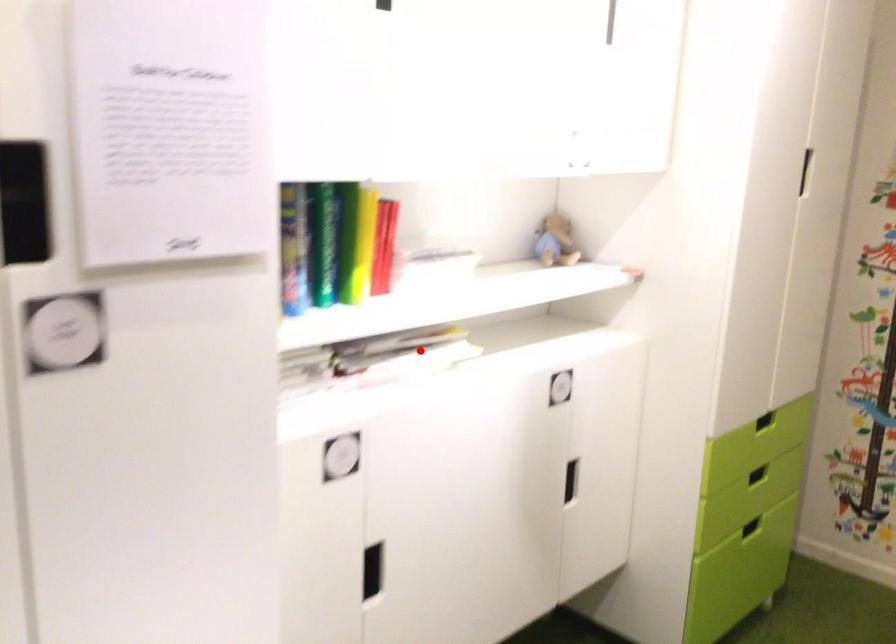
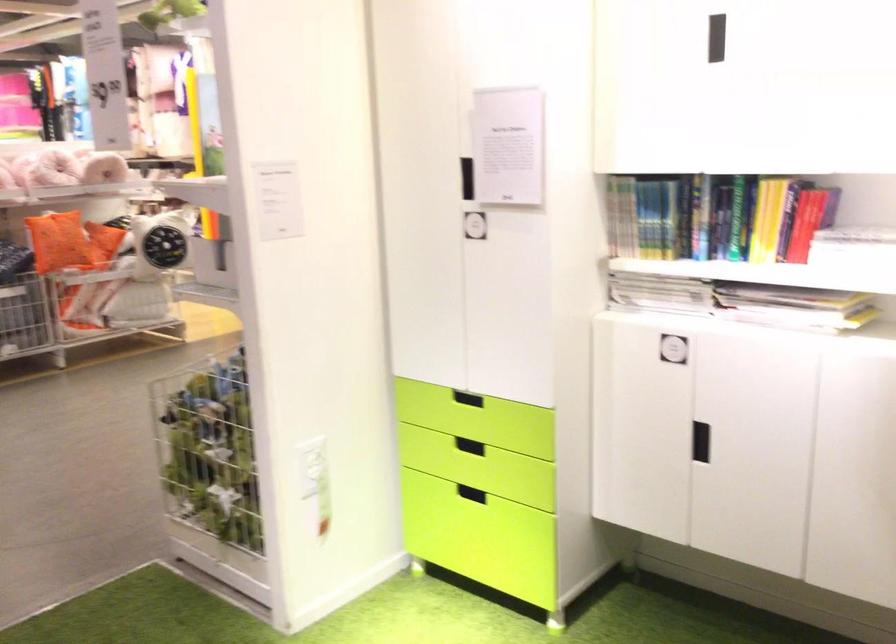
Question: I am providing you with two images of the same scene from different viewpoints. A red point is shown in image1. For the corresponding object point in image2, is it positioned nearer or farther from the camera?

Choices:
 (A) Nearer
 (B) Farther

Answer: (B)